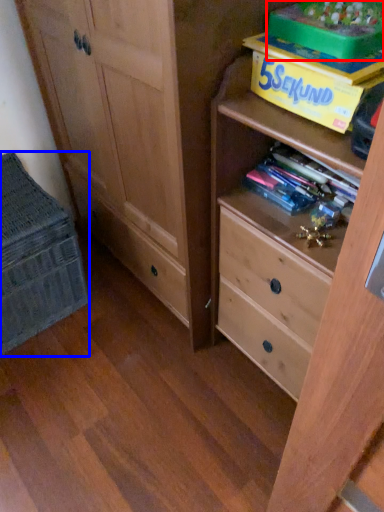
Question: Which object appears farthest to the camera in this image, storage box (highlighted by a red box) or cabinetry (highlighted by a blue box)?

Choices:
 (A) storage box
 (B) cabinetry

Answer: (B)